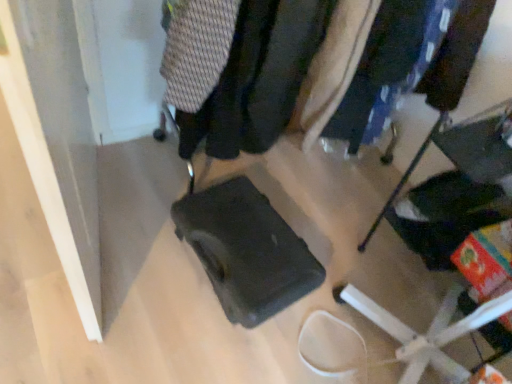
Image resolution: width=512 pixels, height=384 pixels. Find the location of `free spot above matte black suitcase at center (from a real-world perspective)`. free spot above matte black suitcase at center (from a real-world perspective) is located at coordinates (252, 241).